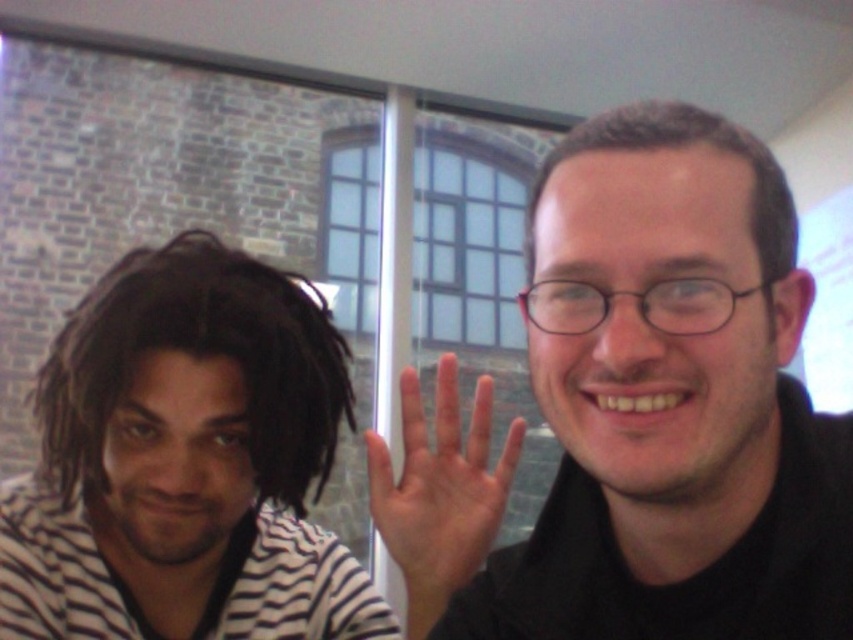
You are a photographer trying to capture a clear shot of both the dark brown dreadlocks at left and the dark brown hair at upper right. Since you want to ensure both are visible in the frame, which of the two should you focus on first to account for their size difference?

The dark brown dreadlocks at left is bigger than dark brown hair at upper right, so you should focus on the dark brown dreadlocks at left first as it occupies more space in the frame.

You are taking a photo of the scene and want to ensure the black matte glasses at upper right are centered in the frame. Given their current position at point 0.627 on the x and 0.787 on the y axis, what adjustments should you make to the camera to center them?

To center the black matte glasses at upper right, move the camera slightly to the left and down since their current position is at point 0.627 on the x and 0.787 on the y axis. The center of the frame is at point 0.5, so moving left reduces the x value and moving down reduces the y value.

You are a photographer trying to capture a candid shot of the dark brown dreadlocks at left and the skinny white hand at center. Since the dreadlocks are above the hand, where should you position your camera relative to the subjects to ensure both are fully visible in the frame?

Position the camera above the subjects so that you can capture the dark brown dreadlocks at left, which are located above the skinny white hand at center, ensuring both are in the frame.